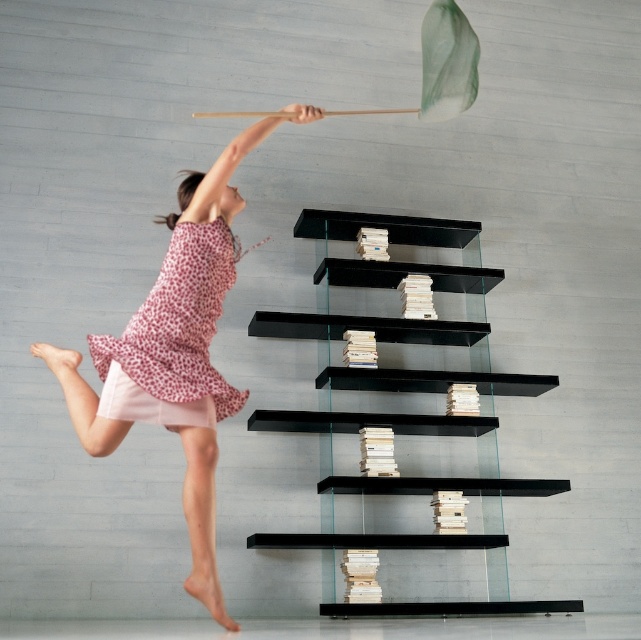
Who is shorter, black glass shelves at center or pink dotted fabric dress at upper left?

With less height is pink dotted fabric dress at upper left.

Which is more to the left, black glass shelves at center or pink dotted fabric dress at upper left?

pink dotted fabric dress at upper left is more to the left.

Between point (319, 216) and point (212, 380), which one is positioned behind?

Positioned behind is point (319, 216).

Find the location of a particular element. This screenshot has height=640, width=641. black glass shelves at center is located at coordinates (404, 426).

Does black glass shelves at center lie in front of pink dotted dress at upper left?

No, it is behind pink dotted dress at upper left.

Is black glass shelves at center shorter than pink dotted dress at upper left?

No.

Describe the element at coordinates (404, 426) in the screenshot. I see `black glass shelves at center` at that location.

Locate an element on the screen. black glass shelves at center is located at coordinates (404, 426).

Looking at this image, does pink dotted dress at upper left appear over pink dotted fabric dress at upper left?

No, pink dotted dress at upper left is not above pink dotted fabric dress at upper left.

Is pink dotted dress at upper left thinner than pink dotted fabric dress at upper left?

No.

Does point (204, 449) come farther from viewer compared to point (163, 289)?

That is False.

Identify the location of pink dotted dress at upper left. (201, 516).